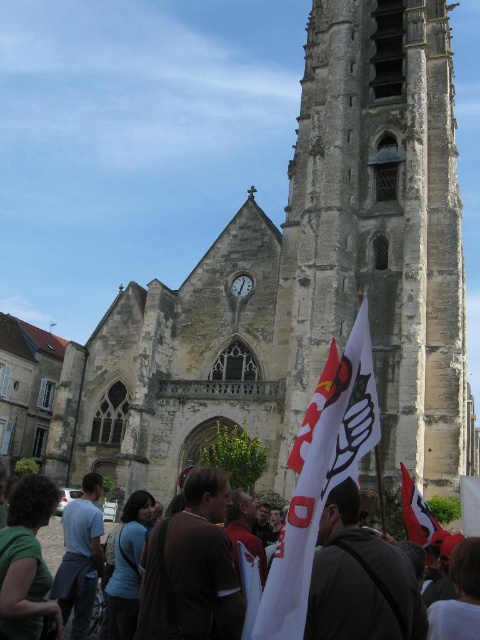
Is blue cotton shirt at lower left positioned at the back of red fabric flag at center?

That is False.

In order to click on blue cotton shirt at lower left in this screenshot , I will do `click(80, 556)`.

The image size is (480, 640). What are the coordinates of `blue cotton shirt at lower left` in the screenshot? It's located at (80, 556).

Which is above, white cotton flags at lower center or red fabric flag at center?

red fabric flag at center is above.

Is white cotton flags at lower center shorter than red fabric flag at center?

Incorrect, white cotton flags at lower center's height does not fall short of red fabric flag at center's.

I want to click on white cotton flags at lower center, so click(x=35, y=500).

Can you confirm if white fabric flag at center is thinner than blue cotton shirt at lower left?

No.

Is point (303, 524) farther from viewer compared to point (82, 605)?

No, it is in front of (82, 605).

Is point (283, 630) more distant than point (86, 627)?

That is False.

The width and height of the screenshot is (480, 640). I want to click on white fabric flag at center, so click(x=321, y=483).